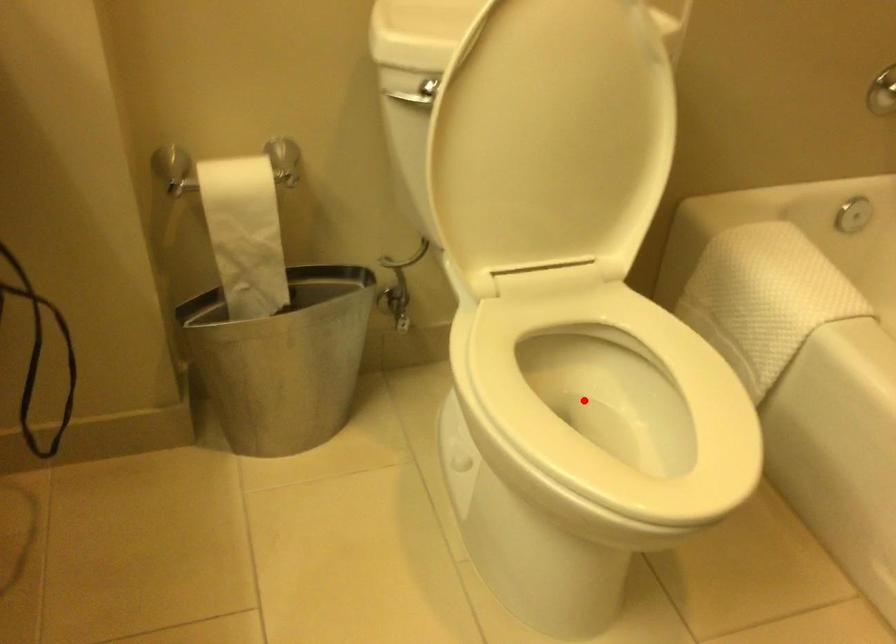
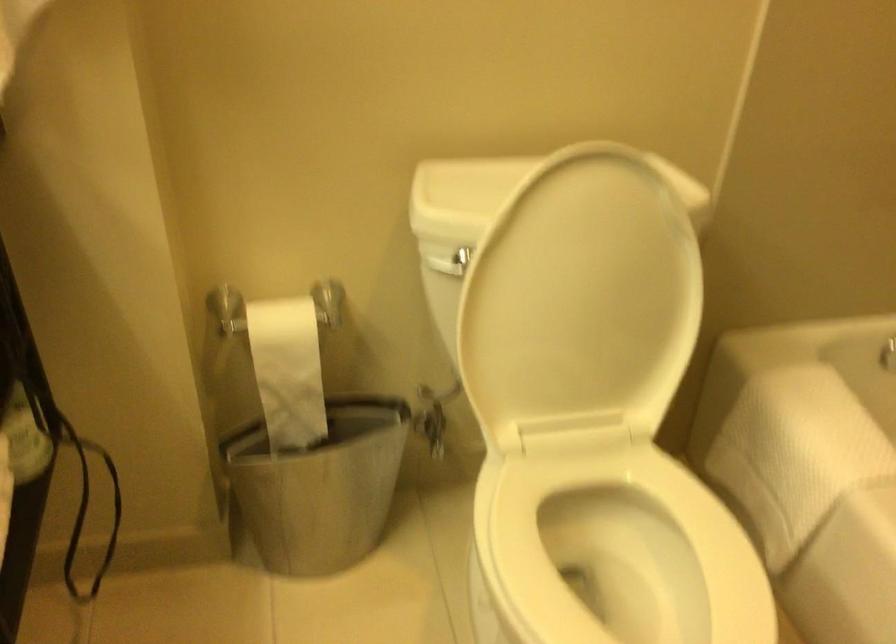
In the second image, find the point that corresponds to the highlighted location in the first image.

(607, 554)